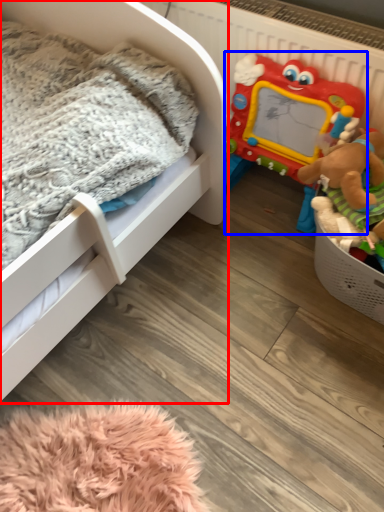
Question: Which object is further to the camera taking this photo, infant bed (highlighted by a red box) or toy (highlighted by a blue box)?

Choices:
 (A) infant bed
 (B) toy

Answer: (B)